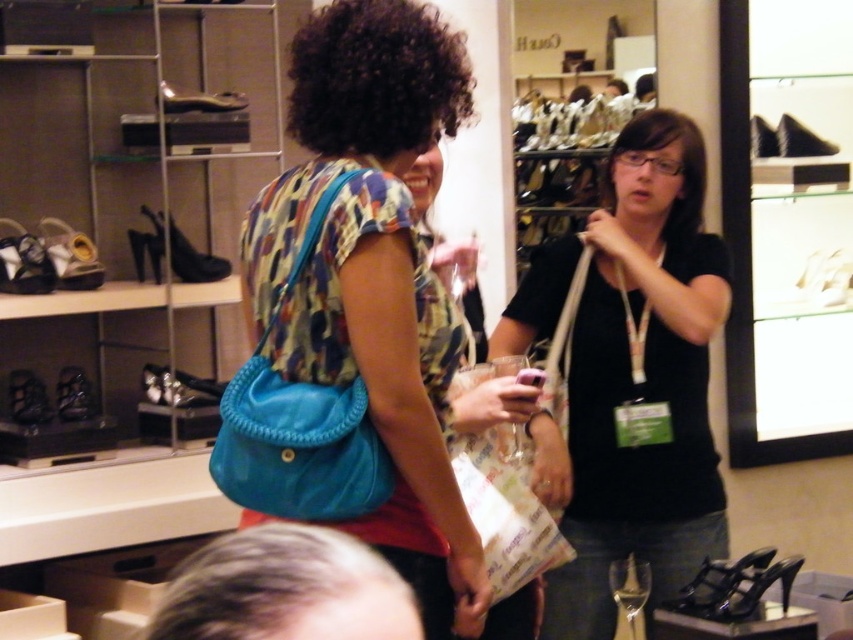
You are a store employee who needs to place the black matte bag at center and the black matte afro at upper center on a shelf. The shelf has a width of 1 meter. Can both items fit side by side without overlapping?

The black matte bag at center is larger in size than the black matte afro at upper center. However, since the shelf is 1 meter wide, both items can fit side by side as their combined size is less than the shelf width.

You are a customer in the shoe store looking to place your new purchase into a bag. You see the black matte bag at center and the black curly hair at center. Which object is located lower in the image?

The black matte bag at center is positioned under black curly hair at center, so the black matte bag at center is located lower in the image.

You are a customer in the shoe store and want to place your black matte bag at center on the floor without blocking the view of the black curly hair at center. Is the bag too tall for this?

The black matte bag at center is much taller than the black curly hair at center, so placing it on the floor would block the view of the black curly hair at center. Choose a shorter bag or place it differently.